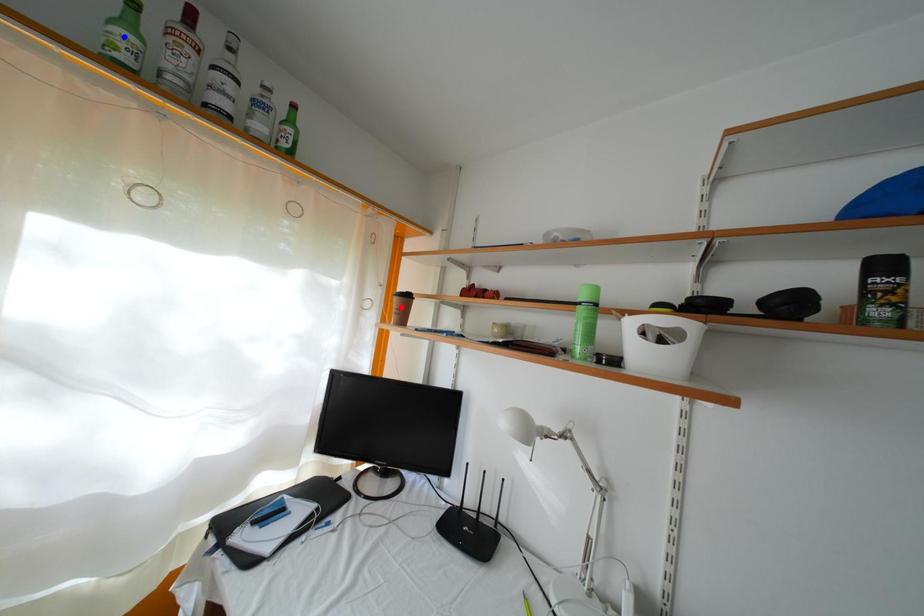
Question: In the image, two points are highlighted. Which point is nearer to the camera? Reply with the corresponding letter.

Choices:
 (A) blue point
 (B) red point

Answer: (A)